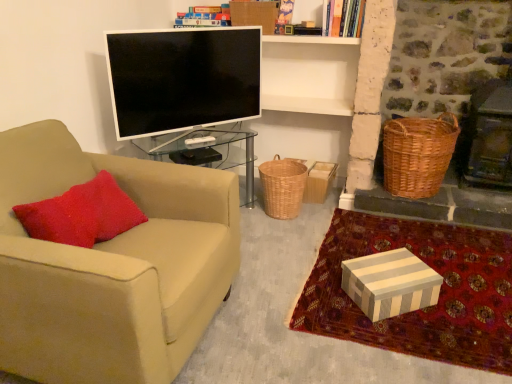
I want to click on unoccupied region to the right of beige fabric chair at left, so click(x=282, y=306).